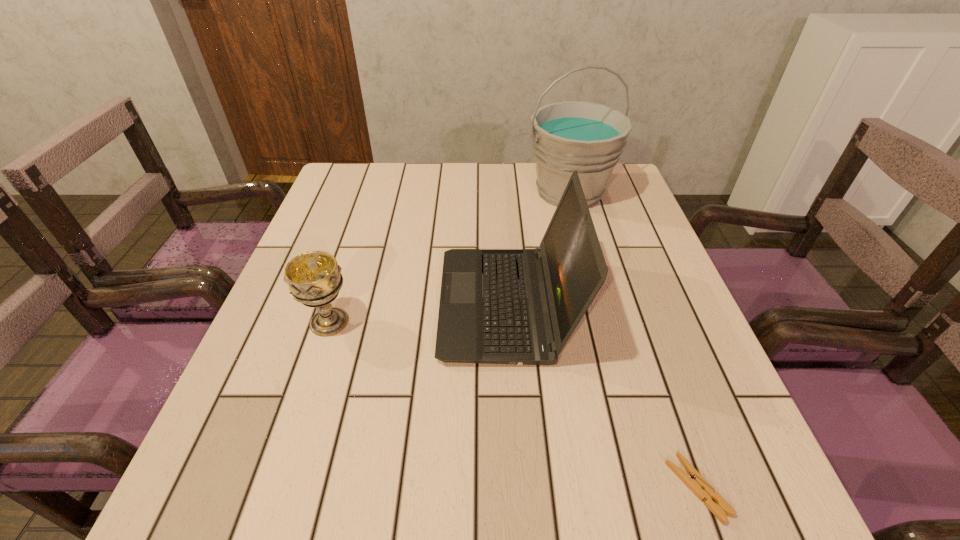
I want to click on free space located 0.230m on the screen of the second tallest object, so click(331, 305).

Locate an element on the screen. free spot located on the back of the chalice is located at coordinates (364, 217).

Identify the location of vacant position located on the left of the shortest object. (612, 488).

Where is `object that is at the far edge`? This screenshot has width=960, height=540. object that is at the far edge is located at coordinates point(588,137).

The height and width of the screenshot is (540, 960). Find the location of `object that is at the near edge`. object that is at the near edge is located at coordinates (694, 481).

The width and height of the screenshot is (960, 540). I want to click on object that is positioned at the left edge, so click(314, 278).

The width and height of the screenshot is (960, 540). In order to click on bucket at the right edge in this screenshot , I will do `click(588, 137)`.

The width and height of the screenshot is (960, 540). Identify the location of clothespin present at the right edge. (694, 481).

The width and height of the screenshot is (960, 540). I want to click on object present at the far right corner, so click(x=588, y=137).

The image size is (960, 540). I want to click on object that is at the near right corner, so click(x=694, y=481).